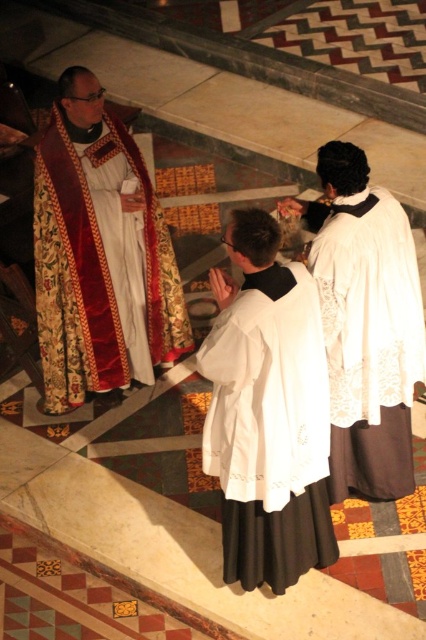
Is white embroidered robe at center closer to the viewer compared to white lace robe at upper right?

Yes, white embroidered robe at center is in front of white lace robe at upper right.

From the picture: Does white embroidered robe at center appear over white lace robe at upper right?

Actually, white embroidered robe at center is below white lace robe at upper right.

Does point (279, 284) lie in front of point (411, 385)?

Yes, point (279, 284) is in front of point (411, 385).

You are a GUI agent. You are given a task and a screenshot of the screen. Output one action in this format:
    pyautogui.click(x=<x>, y=<y>)
    Task: Click on the white embroidered robe at center
    
    Given the screenshot: What is the action you would take?
    pyautogui.click(x=270, y=429)

Is velvet red and gold robe at upper left shorter than white embroidered robe at center?

In fact, velvet red and gold robe at upper left may be taller than white embroidered robe at center.

Between point (66, 365) and point (238, 349), which one is positioned in front?

Point (238, 349) is more forward.

Between point (65, 400) and point (264, 321), which one is positioned in front?

Point (264, 321) is in front.

This screenshot has height=640, width=426. I want to click on velvet red and gold robe at upper left, so click(x=100, y=259).

Is the position of velvet red and gold robe at upper left less distant than that of white lace robe at upper right?

No, it is not.

Is velvet red and gold robe at upper left to the right of white lace robe at upper right from the viewer's perspective?

No, velvet red and gold robe at upper left is not to the right of white lace robe at upper right.

Which is in front, point (60, 109) or point (386, 227)?

Point (386, 227) is in front.

Locate an element on the screen. The width and height of the screenshot is (426, 640). velvet red and gold robe at upper left is located at coordinates (100, 259).